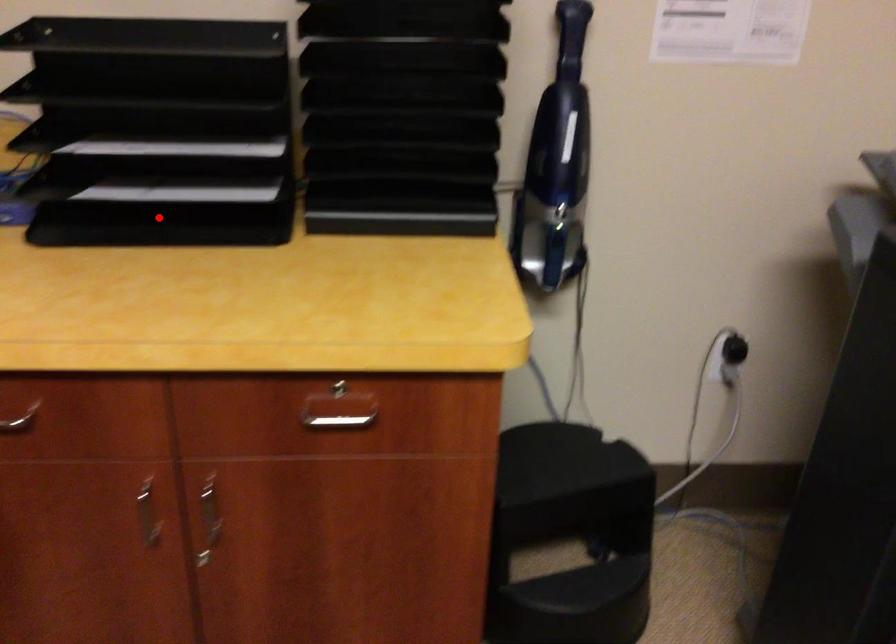
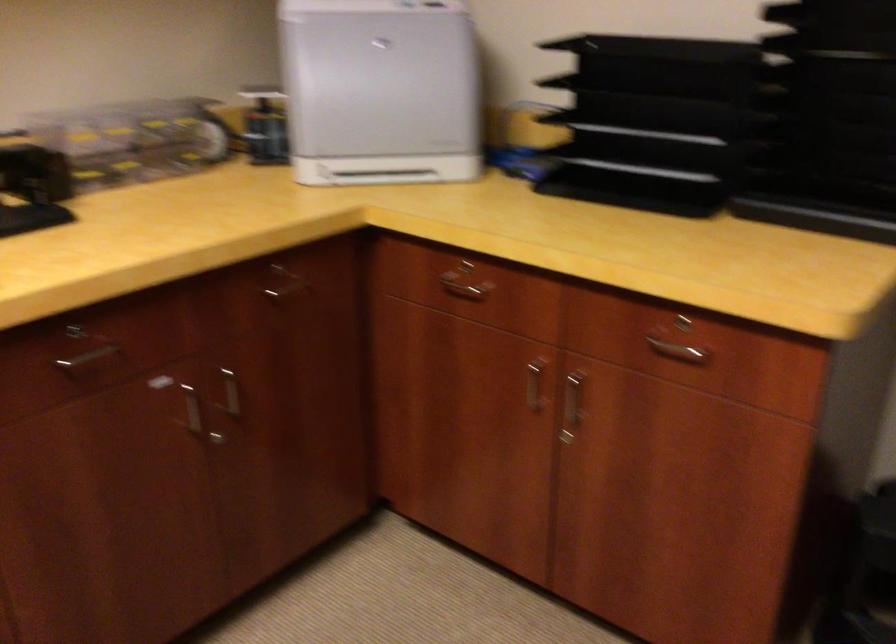
Question: I am providing you with two images of the same scene from different viewpoints. Image1 has a red point marked. In image2, the corresponding 3D location appears at what relative position? Reply with the corresponding letter.

Choices:
 (A) Closer
 (B) Farther

Answer: (B)